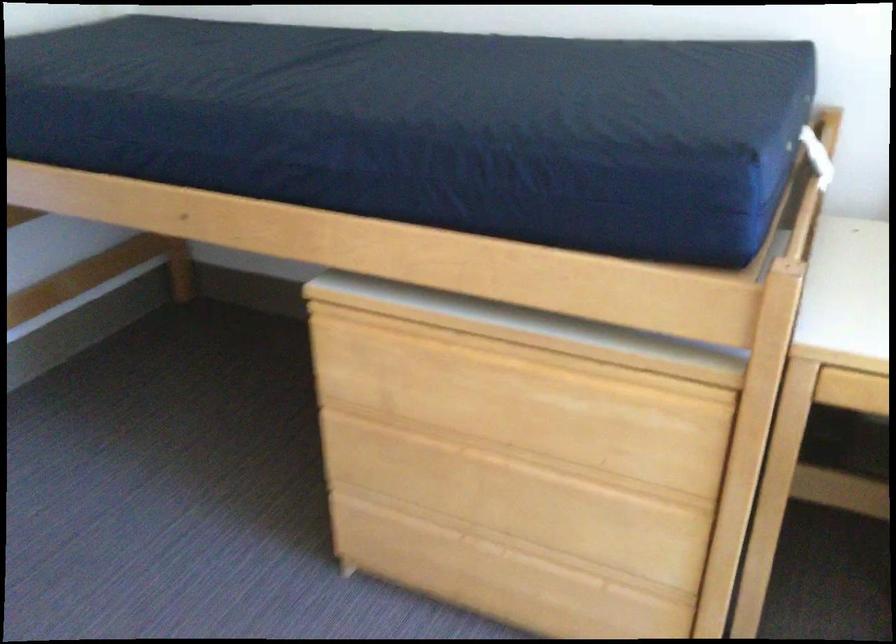
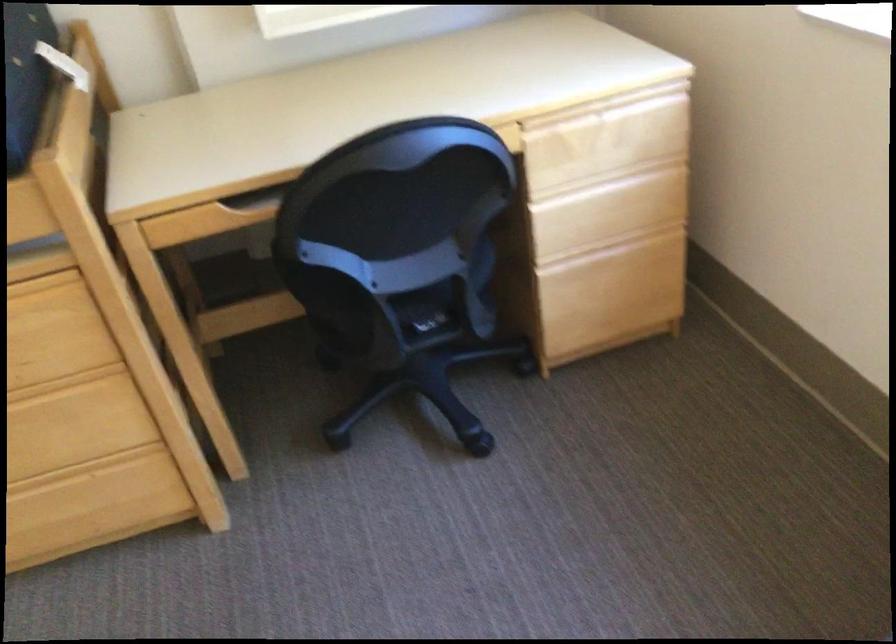
The point at (609, 565) is marked in the first image. Where is the corresponding point in the second image?

(82, 469)